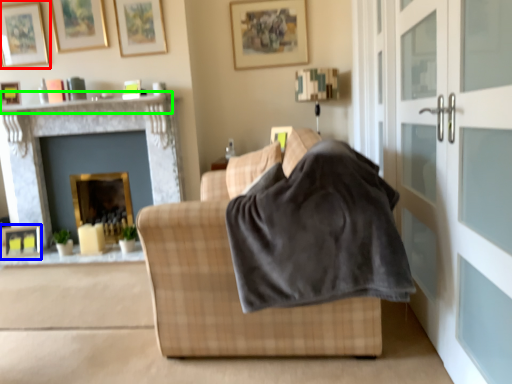
Question: Which object is positioned closest to picture frame (highlighted by a red box)? Select from picture frame (highlighted by a blue box) and mantle (highlighted by a green box).

Choices:
 (A) picture frame
 (B) mantle

Answer: (B)